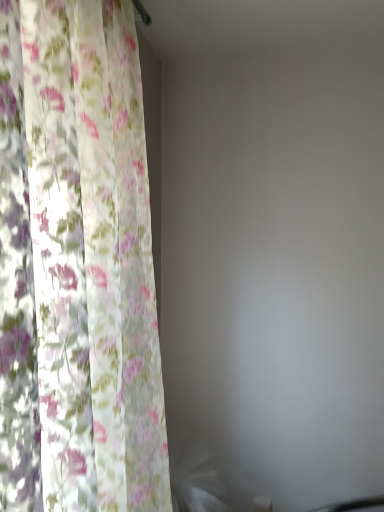
In order to click on floral fabric curtain at left in this screenshot , I will do `click(77, 265)`.

What do you see at coordinates (77, 265) in the screenshot? I see `floral fabric curtain at left` at bounding box center [77, 265].

Image resolution: width=384 pixels, height=512 pixels. In order to click on floral fabric curtain at left in this screenshot , I will do `click(77, 265)`.